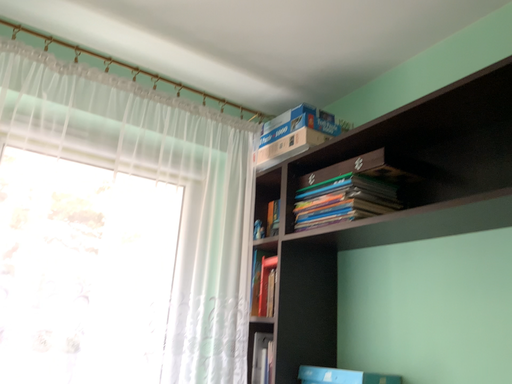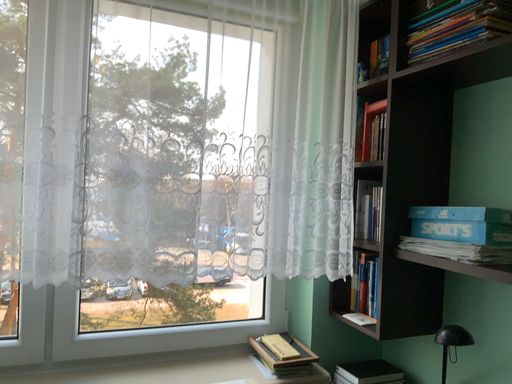
Question: Which way did the camera rotate in the video?

Choices:
 (A) rotated left
 (B) rotated right

Answer: (A)